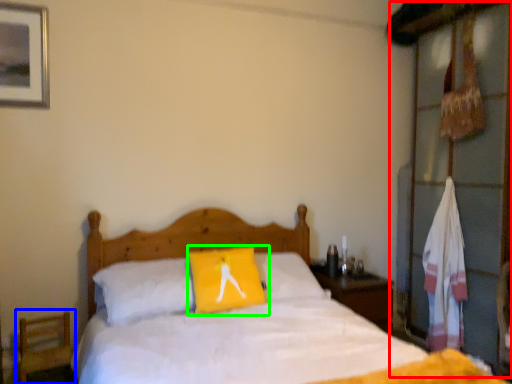
Question: Considering the real-world distances, which object is farthest from dresser (highlighted by a red box)? armchair (highlighted by a blue box) or pillow (highlighted by a green box)?

Choices:
 (A) armchair
 (B) pillow

Answer: (A)